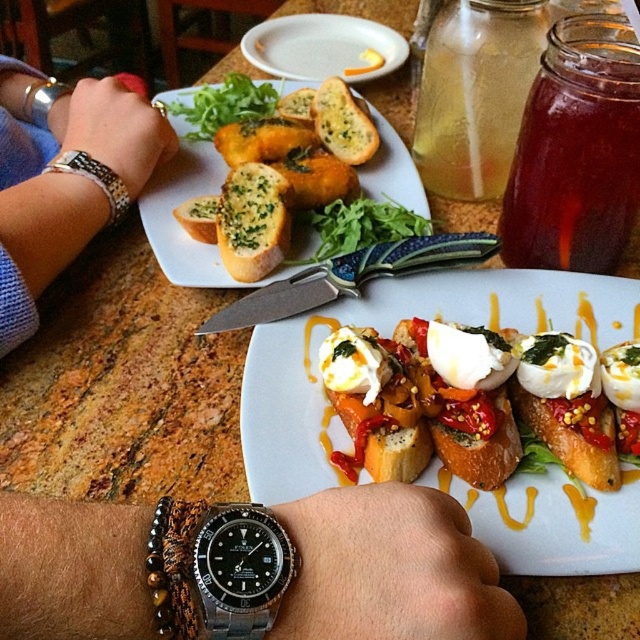
Between translucent glass bottle at upper center and white ceramic plate at upper center, which one appears on the right side from the viewer's perspective?

translucent glass bottle at upper center is more to the right.

Is point (438, 97) farther from camera compared to point (316, 49)?

That is False.

Does point (508, 122) come in front of point (362, 58)?

Yes, point (508, 122) is closer to viewer.

Image resolution: width=640 pixels, height=640 pixels. I want to click on translucent glass bottle at upper center, so click(x=474, y=100).

Is black metal watch at left shorter than breadgolden-brown crustyat center-left?

No, black metal watch at left is not shorter than breadgolden-brown crustyat center-left.

Is black metal watch at left taller than breadgolden-brown crustyat center-left?

Indeed, black metal watch at left has a greater height compared to breadgolden-brown crustyat center-left.

The height and width of the screenshot is (640, 640). Describe the element at coordinates (93, 179) in the screenshot. I see `black metal watch at left` at that location.

This screenshot has width=640, height=640. I want to click on black metal watch at left, so click(93, 179).

Can you confirm if white ceramic plate at upper center is positioned to the left of white garlic bread at center?

A: No, white ceramic plate at upper center is not to the left of white garlic bread at center.

The height and width of the screenshot is (640, 640). In order to click on white ceramic plate at upper center in this screenshot , I will do `click(323, 48)`.